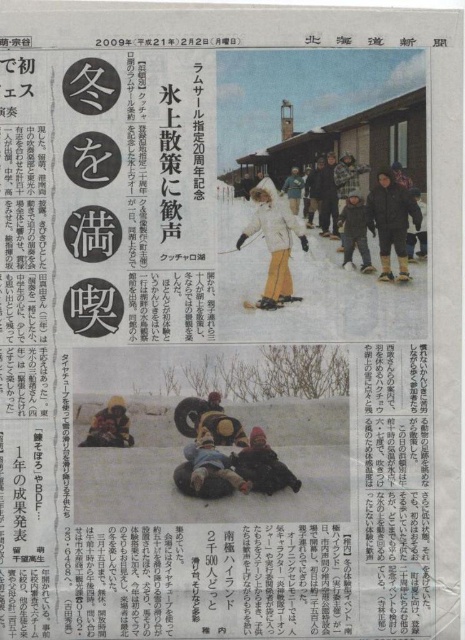
Question: Which of the following is the closest to the observer?

Choices:
 (A) (98, 419)
 (B) (396, 228)
 (C) (276, 198)

Answer: (A)

Question: Does dark brown fur hat at center have a lesser width compared to yellow fuzzy hat at center?

Choices:
 (A) no
 (B) yes

Answer: (A)

Question: Does dark brown fur coat at center appear on the right side of dark brown fur hat at center?

Choices:
 (A) no
 (B) yes

Answer: (B)

Question: Does dark brown fur hat at center appear over yellow fuzzy hat at center?

Choices:
 (A) no
 (B) yes

Answer: (A)

Question: Which object is the farthest from the dark brown fur coat at center?

Choices:
 (A) dark brown fur hat at center
 (B) white matte jacket at center

Answer: (A)

Question: Which of the following is the closest to the observer?

Choices:
 (A) (260, 472)
 (B) (259, 202)

Answer: (A)